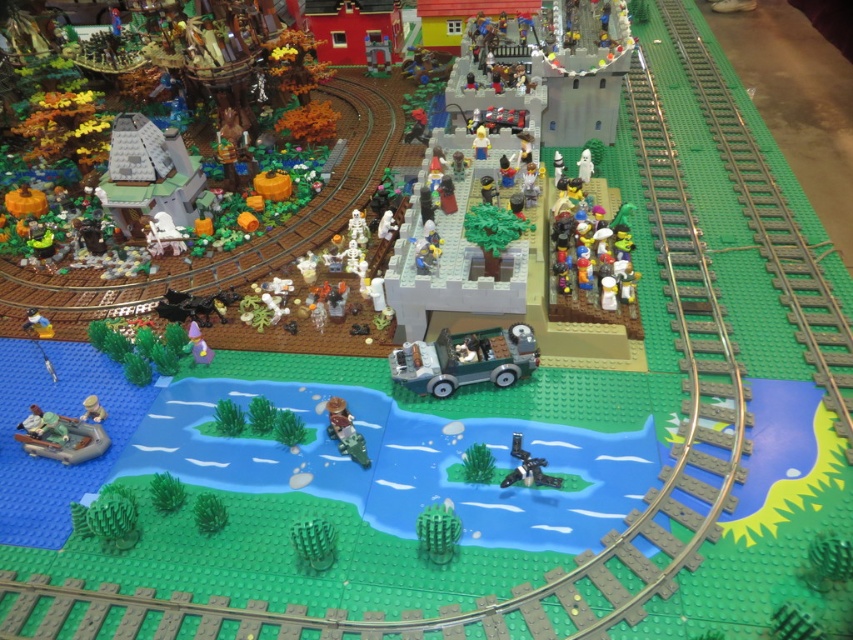
Which of these two, smooth gray castle at upper left or light yellow plastic minifigure at center, stands taller?

smooth gray castle at upper left is taller.

Looking at this image, who is more distant from viewer, (123, 131) or (473, 156)?

Positioned behind is point (473, 156).

Between point (148, 166) and point (485, 141), which one is positioned behind?

The point (485, 141) is behind.

The height and width of the screenshot is (640, 853). What are the coordinates of `smooth gray castle at upper left` in the screenshot? It's located at (149, 173).

At what (x,y) coordinates should I click in order to perform the action: click on rubber green boat at lower left. Please return your answer as a coordinate pair (x, y). The width and height of the screenshot is (853, 640). Looking at the image, I should click on (67, 435).

Who is more forward, (x=86, y=444) or (x=36, y=413)?

Point (x=86, y=444)

Locate an element on the screen. The width and height of the screenshot is (853, 640). rubber green boat at lower left is located at coordinates (67, 435).

Can you confirm if smooth gray castle at upper left is positioned to the left of rubber green boat at lower left?

Indeed, smooth gray castle at upper left is positioned on the left side of rubber green boat at lower left.

The image size is (853, 640). Describe the element at coordinates (149, 173) in the screenshot. I see `smooth gray castle at upper left` at that location.

The height and width of the screenshot is (640, 853). What are the coordinates of `smooth gray castle at upper left` in the screenshot? It's located at (149, 173).